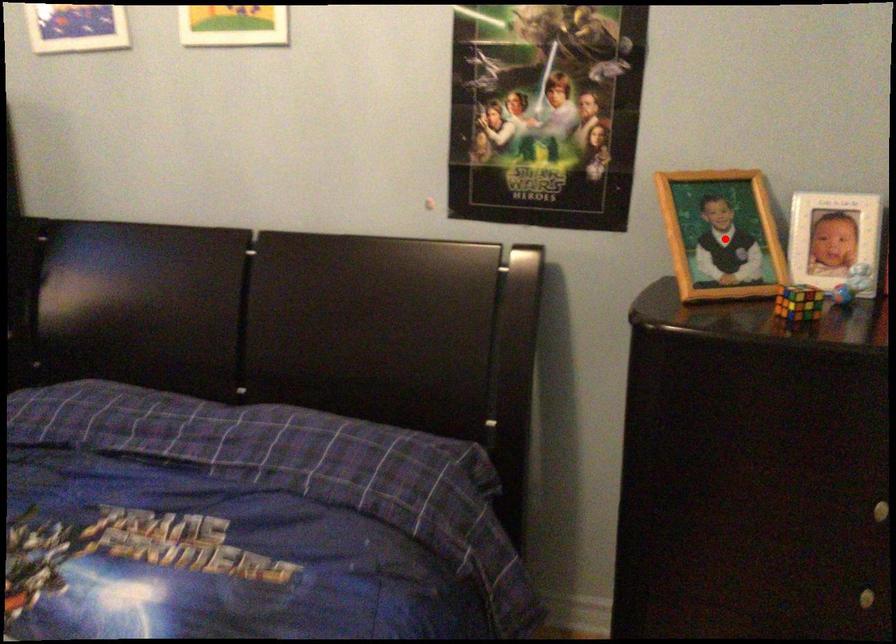
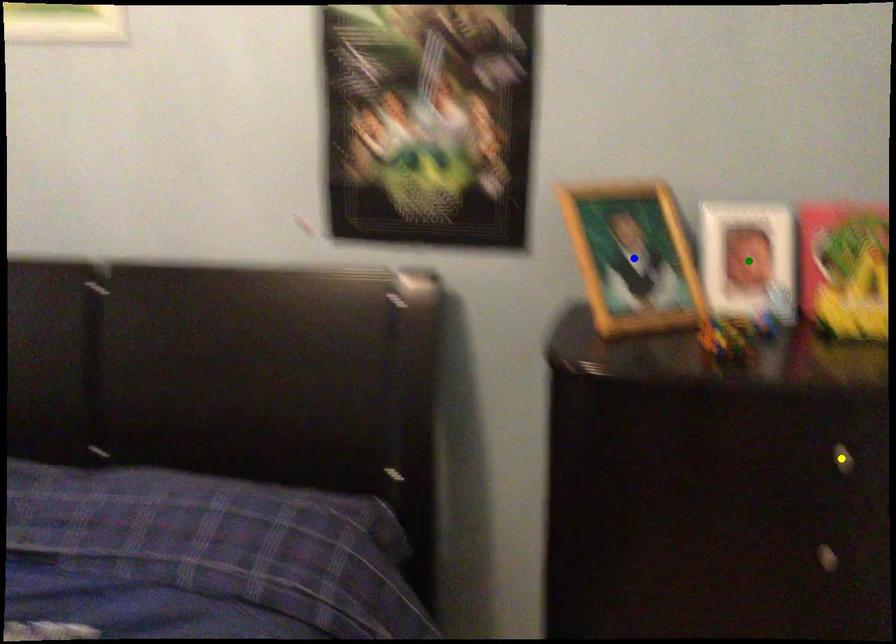
Question: I am providing you with two images of the same scene from different viewpoints. A red point is marked on the first image. You are given multiple points on the second image. Which point in image 2 represents the same 3d spot as the red point in image 1?

Choices:
 (A) blue point
 (B) yellow point
 (C) green point

Answer: (A)